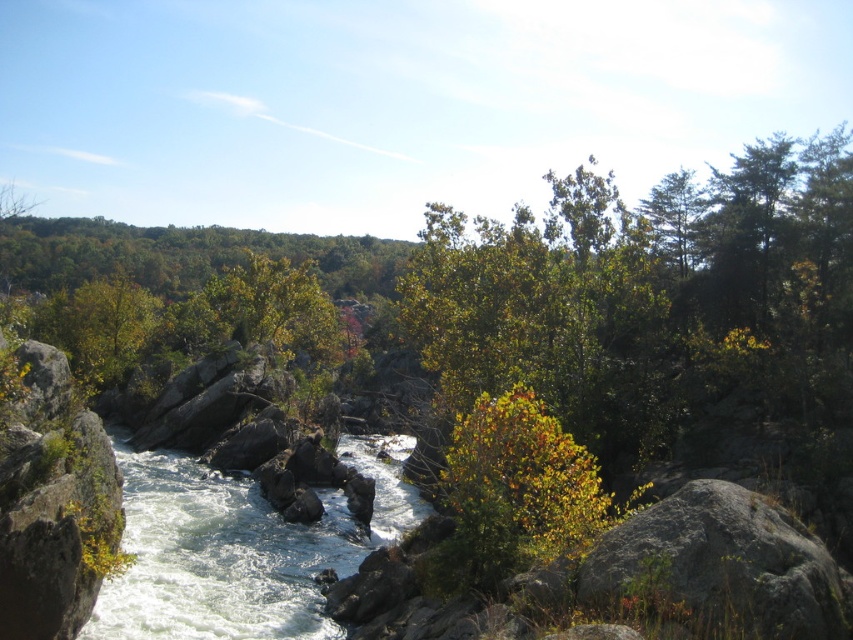
Which is above, white frothy water at center or green leafy bush at center?

green leafy bush at center is higher up.

Looking at this image, measure the distance between white frothy water at center and camera.

white frothy water at center is 16.68 meters from camera.

Where is `white frothy water at center`? This screenshot has width=853, height=640. white frothy water at center is located at coordinates (239, 547).